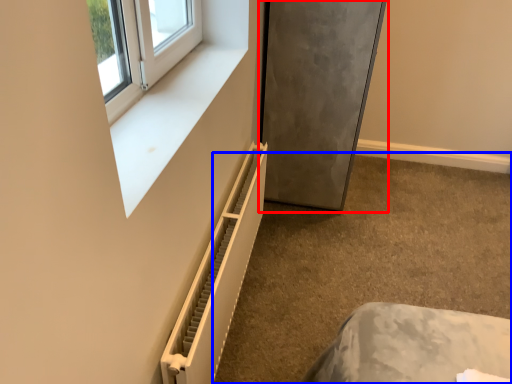
Question: Which object is closer to the camera taking this photo, fridge (highlighted by a red box) or concrete (highlighted by a blue box)?

Choices:
 (A) fridge
 (B) concrete

Answer: (B)